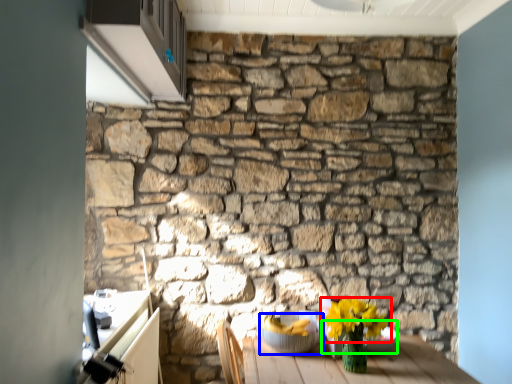
Question: Considering the real-world distances, which object is closest to flower (highlighted by a red box)? glass bowl (highlighted by a blue box) or glass bowl (highlighted by a green box).

Choices:
 (A) glass bowl
 (B) glass bowl

Answer: (B)